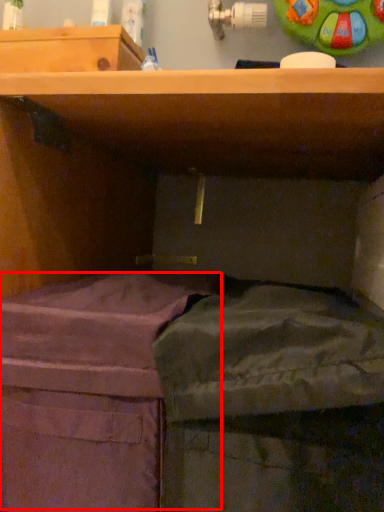
Question: Where is wide (annotated by the red box) located in relation to wide in the image?

Choices:
 (A) left
 (B) right

Answer: (A)